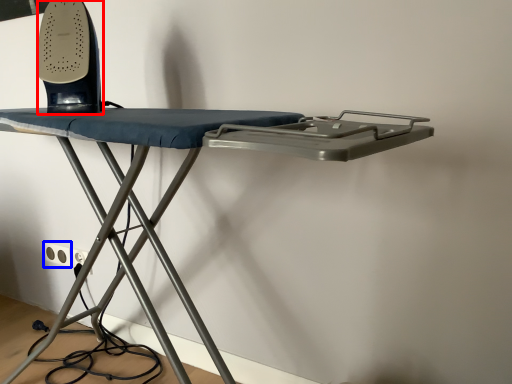
Question: Which point is further to the camera, equipment (highlighted by a red box) or electric outlet (highlighted by a blue box)?

Choices:
 (A) equipment
 (B) electric outlet

Answer: (B)